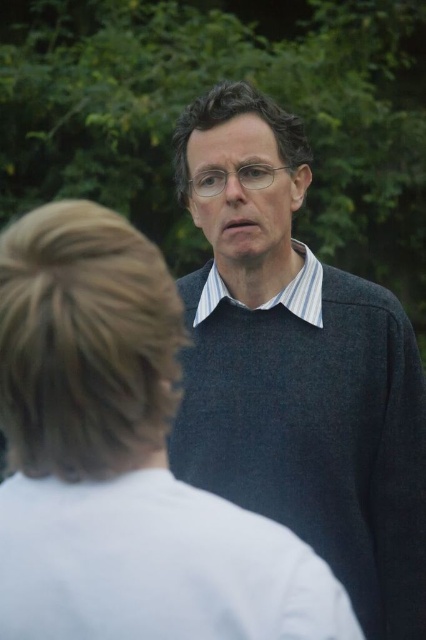
In the scene shown: Can you confirm if dark gray sweater at center is shorter than striped cotton shirt at center?

Incorrect, dark gray sweater at center's height does not fall short of striped cotton shirt at center's.

Which is in front, point (198, 444) or point (301, 317)?

Positioned in front is point (198, 444).

Is point (262, 196) in front of point (213, 284)?

Yes, point (262, 196) is closer to viewer.

Locate an element on the screen. This screenshot has height=640, width=426. dark gray sweater at center is located at coordinates (296, 368).

Consider the image. Is white matte shirt at center shorter than dark gray sweater at center?

Indeed, white matte shirt at center has a lesser height compared to dark gray sweater at center.

Does white matte shirt at center have a greater width compared to dark gray sweater at center?

No.

Which is in front, point (310, 570) or point (359, 292)?

Positioned in front is point (310, 570).

Where is `white matte shirt at center`? This screenshot has height=640, width=426. white matte shirt at center is located at coordinates (121, 460).

Who is shorter, white matte shirt at center or striped cotton shirt at center?

striped cotton shirt at center is shorter.

Between white matte shirt at center and striped cotton shirt at center, which one appears on the right side from the viewer's perspective?

A: striped cotton shirt at center

Between point (163, 364) and point (305, 244), which one is positioned behind?

Point (305, 244)

In order to click on white matte shirt at center in this screenshot , I will do `click(121, 460)`.